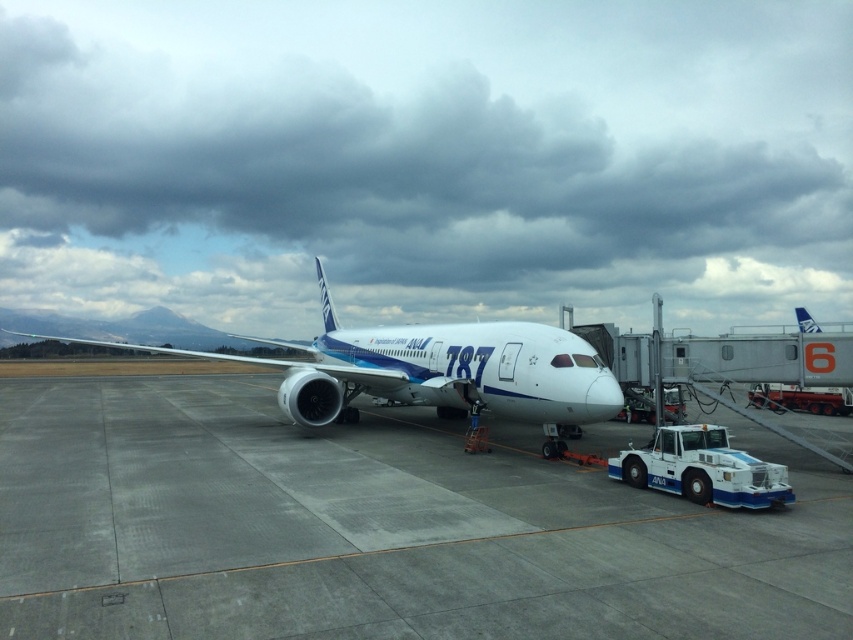
You are a pilot preparing for takeoff and looking out the cockpit window. You notice the cloudy sky at upper center and the white glossy airplane at center. Which object appears bigger in your view?

The cloudy sky at upper center appears bigger than the white glossy airplane at center because it is larger in size.

What is the position of the cloudy sky at upper center in the image?

The cloudy sky at upper center is located at point coordinates of (427, 160).